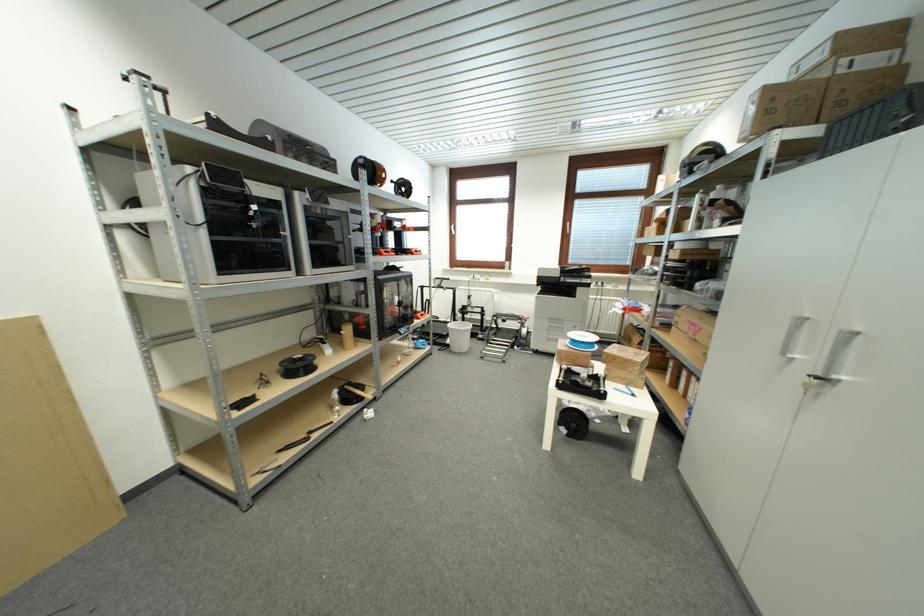
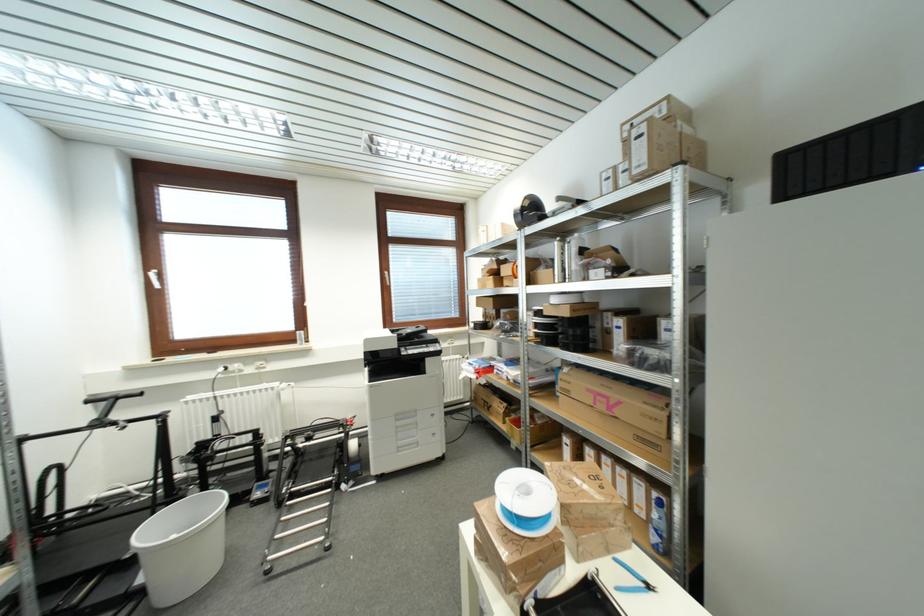
Find the pixel in the second image that matches pixel 638 398 in the first image.

(652, 590)